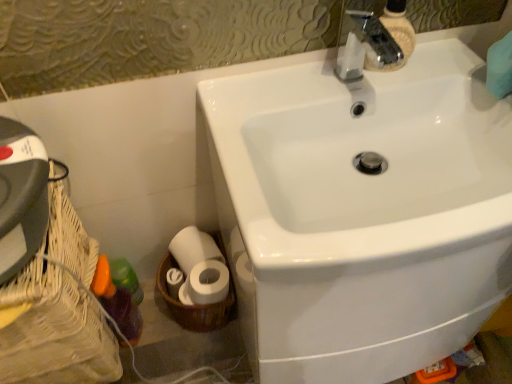
Question: From a real-world perspective, is white glossy sink at upper right on white woven basket at lower left, which ranks as the 1th basket container in right-to-left order?

Choices:
 (A) no
 (B) yes

Answer: (B)

Question: Considering the relative sizes of white glossy sink at upper right and white woven basket at lower left, which ranks as the 1th basket container in right-to-left order, in the image provided, is white glossy sink at upper right bigger than white woven basket at lower left, which ranks as the 1th basket container in right-to-left order,?

Choices:
 (A) yes
 (B) no

Answer: (A)

Question: Is white glossy sink at upper right facing towards white woven basket at lower left, which ranks as the 1th basket container in right-to-left order?

Choices:
 (A) no
 (B) yes

Answer: (A)

Question: Considering the relative sizes of white glossy sink at upper right and white woven basket at lower left, which appears as the second basket container when viewed from the left, in the image provided, is white glossy sink at upper right shorter than white woven basket at lower left, which appears as the second basket container when viewed from the left,?

Choices:
 (A) yes
 (B) no

Answer: (B)

Question: Are white glossy sink at upper right and white woven basket at lower left, which ranks as the 1th basket container in right-to-left order, located far from each other?

Choices:
 (A) no
 (B) yes

Answer: (A)

Question: Is white glossy sink at upper right beside white woven basket at lower left, which ranks as the 1th basket container in right-to-left order?

Choices:
 (A) yes
 (B) no

Answer: (B)

Question: From the image's perspective, does white woven basket at lower left, which ranks as the 1th basket container in right-to-left order, appear lower than translucent plastic bottle at lower left?

Choices:
 (A) yes
 (B) no

Answer: (B)

Question: Is white woven basket at lower left, which ranks as the 1th basket container in right-to-left order, oriented away from translucent plastic bottle at lower left?

Choices:
 (A) no
 (B) yes

Answer: (A)

Question: Does white woven basket at lower left, which appears as the second basket container when viewed from the left, have a lesser height compared to translucent plastic bottle at lower left?

Choices:
 (A) no
 (B) yes

Answer: (B)

Question: Would you say translucent plastic bottle at lower left is part of white woven basket at lower left, which ranks as the 1th basket container in right-to-left order,'s contents?

Choices:
 (A) yes
 (B) no

Answer: (B)

Question: From a real-world perspective, is white woven basket at lower left, which ranks as the 1th basket container in right-to-left order, located beneath translucent plastic bottle at lower left?

Choices:
 (A) yes
 (B) no

Answer: (A)

Question: Is white woven basket at lower left, which ranks as the 1th basket container in right-to-left order, wider than translucent plastic bottle at lower left?

Choices:
 (A) yes
 (B) no

Answer: (A)

Question: Could woven wood basket at lower left, which is the second basket container from right to left, be considered to be inside white glossy sink at upper right?

Choices:
 (A) yes
 (B) no

Answer: (B)